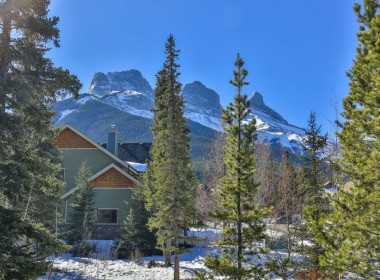
The width and height of the screenshot is (380, 280). I want to click on window, so click(x=109, y=219).